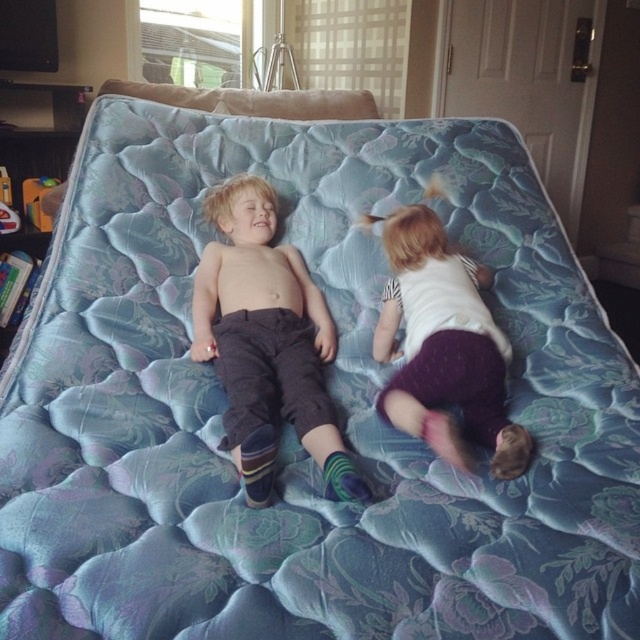
Question: Among these objects, which one is nearest to the camera?

Choices:
 (A) matte white shirt at center
 (B) matte gray pants at center

Answer: (B)

Question: Is matte gray pants at center above matte white shirt at center?

Choices:
 (A) yes
 (B) no

Answer: (A)

Question: Can you confirm if matte gray pants at center is positioned to the right of matte white shirt at center?

Choices:
 (A) yes
 (B) no

Answer: (B)

Question: Which point is farther from the camera taking this photo?

Choices:
 (A) (272, 259)
 (B) (499, 380)

Answer: (A)

Question: Observing the image, what is the correct spatial positioning of matte gray pants at center in reference to matte white shirt at center?

Choices:
 (A) above
 (B) below

Answer: (A)